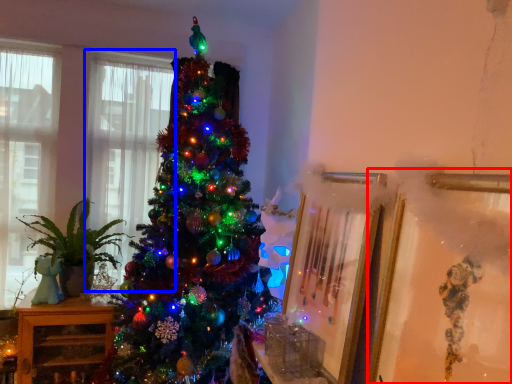
Question: Which object appears closest to the camera in this image, picture frame (highlighted by a red box) or window (highlighted by a blue box)?

Choices:
 (A) picture frame
 (B) window

Answer: (A)